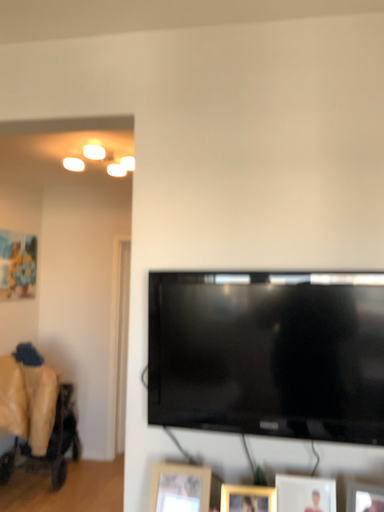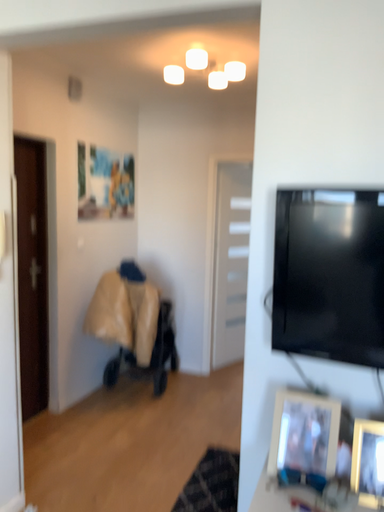
Question: How did the camera likely rotate when shooting the video?

Choices:
 (A) rotated right
 (B) rotated left

Answer: (B)